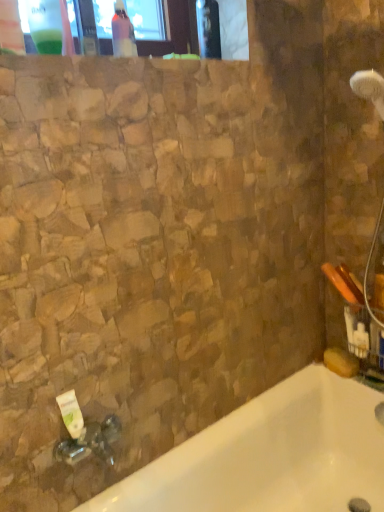
Question: From their relative heights in the image, would you say white glossy bathtub at lower left is taller or shorter than white matte tube at lower left?

Choices:
 (A) short
 (B) tall

Answer: (B)

Question: From a real-world perspective, is white glossy bathtub at lower left positioned above or below white matte tube at lower left?

Choices:
 (A) above
 (B) below

Answer: (B)

Question: Which object is the closest to the white matte tube at lower left?

Choices:
 (A) white glossy bathtub at lower left
 (B) transparent plastic bottle at upper left, arranged as the 2th bottle when viewed from the right
 (C) pink glossy bottle at upper center, which is the 2th bottle from front to back

Answer: (A)

Question: Estimate the real-world distances between objects in this image. Which object is closer to the white matte tube at lower left?

Choices:
 (A) pink glossy bottle at upper center, which is the 2th bottle from front to back
 (B) white glossy bathtub at lower left
 (C) transparent plastic bottle at upper left, the first bottle positioned from the front

Answer: (B)